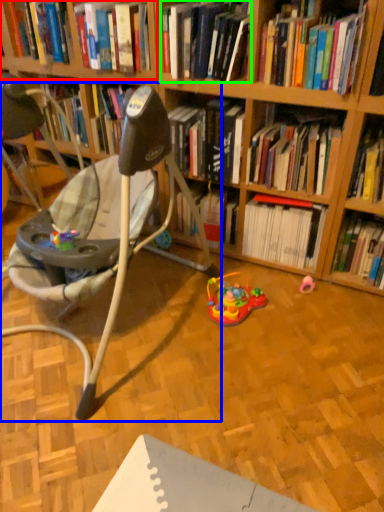
Question: Which object is positioned closest to shelf (highlighted by a red box)? Select from chair (highlighted by a blue box) and book (highlighted by a green box).

Choices:
 (A) chair
 (B) book

Answer: (B)